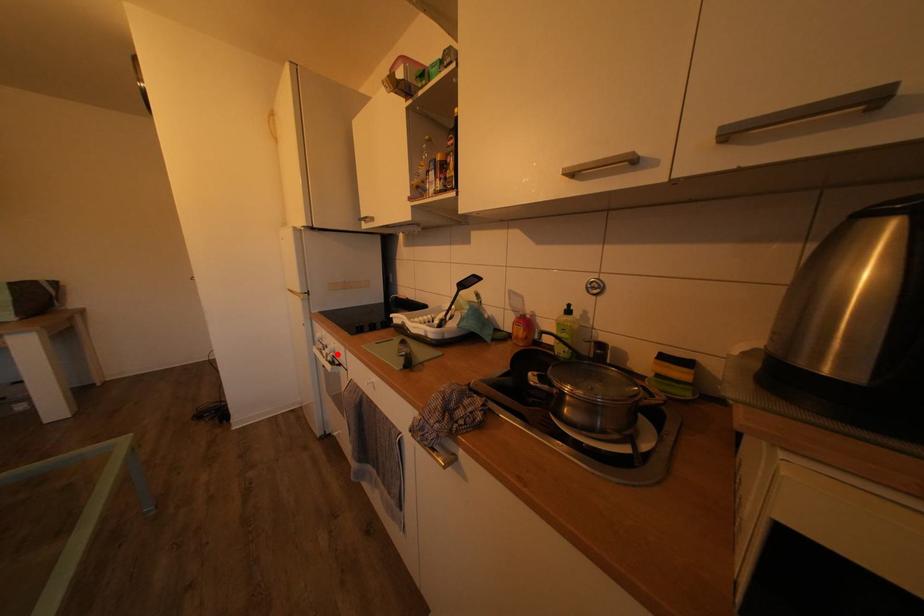
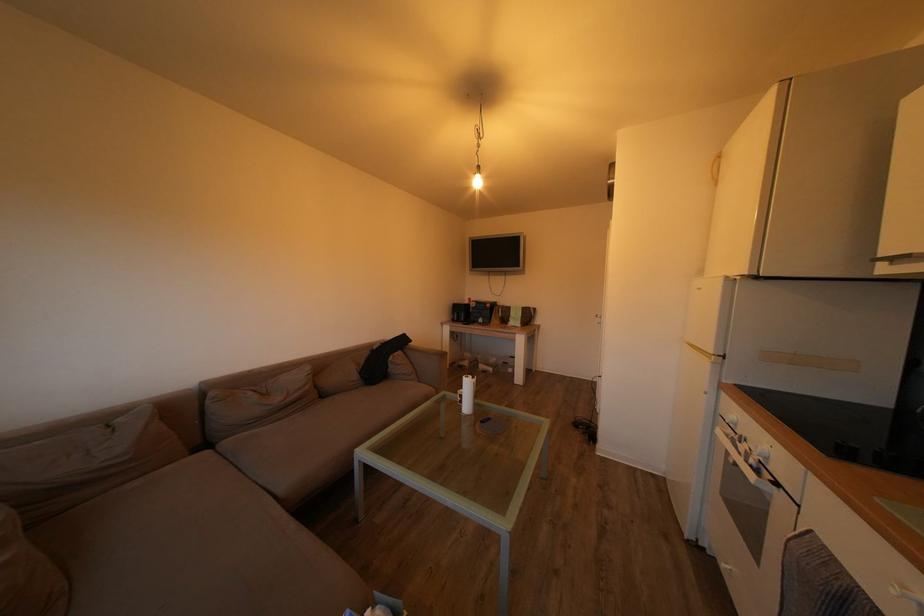
Question: I am providing you with two images of the same scene from different viewpoints. A red point is shown in image1. For the corresponding object point in image2, is it positioned nearer or farther from the camera?

Choices:
 (A) Nearer
 (B) Farther

Answer: (A)